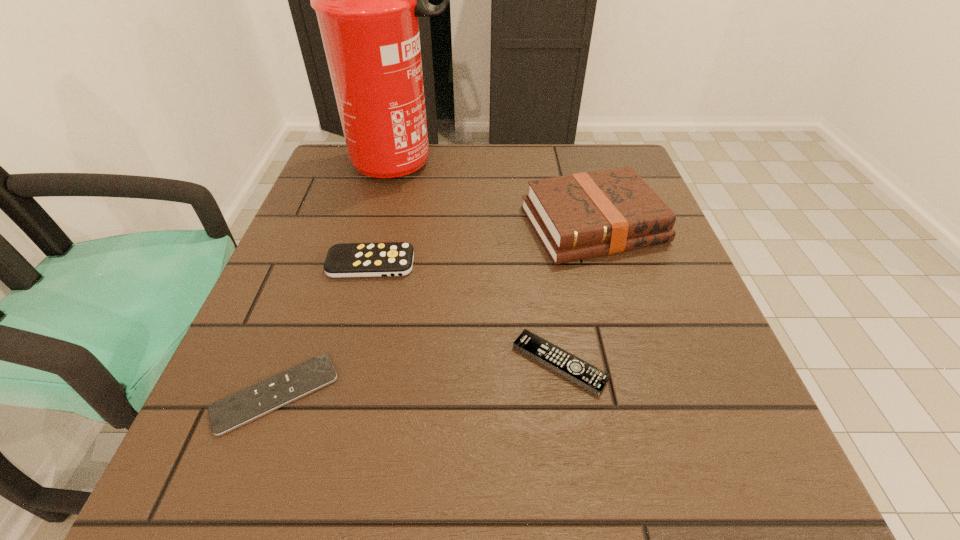
Locate an element on the screen. This screenshot has height=540, width=960. the tallest object is located at coordinates (367, 0).

At what (x,y) coordinates should I click in order to perform the action: click on fire extinguisher. Please return your answer as a coordinate pair (x, y). Looking at the image, I should click on (367, 0).

The image size is (960, 540). In order to click on hardback book in this screenshot , I will do `click(583, 215)`.

Locate an element on the screen. The height and width of the screenshot is (540, 960). the tallest remote control is located at coordinates (392, 258).

Where is `the third tallest object`? the third tallest object is located at coordinates (392, 258).

Locate an element on the screen. The height and width of the screenshot is (540, 960). the fourth tallest object is located at coordinates (593, 379).

The height and width of the screenshot is (540, 960). Identify the location of the rightmost remote control. (593, 379).

Where is `the shortest object`? The width and height of the screenshot is (960, 540). the shortest object is located at coordinates (240, 408).

The image size is (960, 540). Identify the location of vacant space located 0.080m on the trigger side of the fire extinguisher. (487, 164).

The image size is (960, 540). Identify the location of free space located on the left of the hardback book. (495, 225).